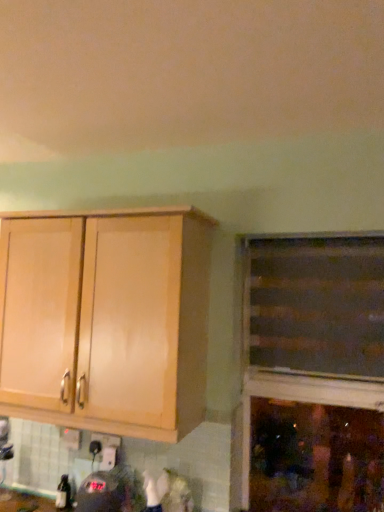
Measure the distance between wooden cabinet at right, acting as the second cabinetry starting from the left, and camera.

5.32 feet.

Find the location of `light wood cabinet at left, placed as the 1th cabinetry when sorted from left to right`. light wood cabinet at left, placed as the 1th cabinetry when sorted from left to right is located at coordinates point(106,321).

Could wooden cabinet at right, which is the 1th cabinetry from right to left, be considered to be inside white plastic electric outlet at lower center?

That's incorrect, wooden cabinet at right, which is the 1th cabinetry from right to left, is not inside white plastic electric outlet at lower center.

How different are the orientations of white plastic electric outlet at lower center and wooden cabinet at right, which is the 1th cabinetry from right to left, in degrees?

The angular difference between white plastic electric outlet at lower center and wooden cabinet at right, which is the 1th cabinetry from right to left, is 0.597 degrees.

Looking at this image, who is smaller, white plastic electric outlet at lower center or wooden cabinet at right, acting as the second cabinetry starting from the left?

white plastic electric outlet at lower center.

Would you say white plastic electric outlet at lower center is a long distance from wooden cabinet at right, acting as the second cabinetry starting from the left?

Actually, white plastic electric outlet at lower center and wooden cabinet at right, acting as the second cabinetry starting from the left, are a little close together.

Is point (96, 370) positioned after point (116, 435)?

That is False.

Does light wood cabinet at left, which ranks as the 2th cabinetry in right-to-left order, have a lesser height compared to white plastic electric outlet at lower center?

Incorrect, the height of light wood cabinet at left, which ranks as the 2th cabinetry in right-to-left order, does not fall short of that of white plastic electric outlet at lower center.

Is white plastic electric outlet at lower center inside light wood cabinet at left, placed as the 1th cabinetry when sorted from left to right?

No, white plastic electric outlet at lower center is not a part of light wood cabinet at left, placed as the 1th cabinetry when sorted from left to right.

Which is more to the right, wooden cabinet at right, which is the 1th cabinetry from right to left, or white plastic electric outlet at lower center?

wooden cabinet at right, which is the 1th cabinetry from right to left.

From a real-world perspective, which object stands above the other?

In real-world perspective, wooden cabinet at right, acting as the second cabinetry starting from the left, is above.

Is wooden cabinet at right, acting as the second cabinetry starting from the left, oriented away from white plastic electric outlet at lower center?

No, wooden cabinet at right, acting as the second cabinetry starting from the left,'s orientation is not away from white plastic electric outlet at lower center.

Considering the sizes of objects wooden cabinet at right, acting as the second cabinetry starting from the left, and light wood cabinet at left, which ranks as the 2th cabinetry in right-to-left order, in the image provided, who is bigger, wooden cabinet at right, acting as the second cabinetry starting from the left, or light wood cabinet at left, which ranks as the 2th cabinetry in right-to-left order,?

light wood cabinet at left, which ranks as the 2th cabinetry in right-to-left order, is bigger.

From the image's perspective, is wooden cabinet at right, which is the 1th cabinetry from right to left, above or below light wood cabinet at left, which ranks as the 2th cabinetry in right-to-left order?

From the image's perspective, wooden cabinet at right, which is the 1th cabinetry from right to left, appears above light wood cabinet at left, which ranks as the 2th cabinetry in right-to-left order.

Is wooden cabinet at right, acting as the second cabinetry starting from the left, positioned beyond the bounds of light wood cabinet at left, placed as the 1th cabinetry when sorted from left to right?

Absolutely, wooden cabinet at right, acting as the second cabinetry starting from the left, is external to light wood cabinet at left, placed as the 1th cabinetry when sorted from left to right.

Is wooden cabinet at right, acting as the second cabinetry starting from the left, far from light wood cabinet at left, which ranks as the 2th cabinetry in right-to-left order?

No, wooden cabinet at right, acting as the second cabinetry starting from the left, is not far away from light wood cabinet at left, which ranks as the 2th cabinetry in right-to-left order.

Is light wood cabinet at left, which ranks as the 2th cabinetry in right-to-left order, looking in the opposite direction of wooden cabinet at right, which is the 1th cabinetry from right to left?

No, light wood cabinet at left, which ranks as the 2th cabinetry in right-to-left order,'s orientation is not away from wooden cabinet at right, which is the 1th cabinetry from right to left.

Can you confirm if light wood cabinet at left, placed as the 1th cabinetry when sorted from left to right, is positioned to the right of wooden cabinet at right, acting as the second cabinetry starting from the left?

No.

Based on their sizes in the image, would you say light wood cabinet at left, placed as the 1th cabinetry when sorted from left to right, is bigger or smaller than wooden cabinet at right, acting as the second cabinetry starting from the left?

In the image, light wood cabinet at left, placed as the 1th cabinetry when sorted from left to right, appears to be larger than wooden cabinet at right, acting as the second cabinetry starting from the left.

Considering the positions of points (94, 439) and (66, 318), is point (94, 439) farther from camera compared to point (66, 318)?

Yes.

You are a GUI agent. You are given a task and a screenshot of the screen. Output one action in this format:
    pyautogui.click(x=<x>, y=<y>)
    Task: Click on the electric outlet behind the light wood cabinet at left, which ranks as the 2th cabinetry in right-to-left order
    This screenshot has width=384, height=512.
    Given the screenshot: What is the action you would take?
    pyautogui.click(x=107, y=440)

Considering the relative positions of white plastic electric outlet at lower center and light wood cabinet at left, placed as the 1th cabinetry when sorted from left to right, in the image provided, is white plastic electric outlet at lower center in front of light wood cabinet at left, placed as the 1th cabinetry when sorted from left to right,?

No, the depth of white plastic electric outlet at lower center is greater than that of light wood cabinet at left, placed as the 1th cabinetry when sorted from left to right.

From a real-world perspective, which is physically above, white plastic electric outlet at lower center or light wood cabinet at left, which ranks as the 2th cabinetry in right-to-left order?

From a 3D spatial view, light wood cabinet at left, which ranks as the 2th cabinetry in right-to-left order, is above.

Identify the location of the 2nd cabinetry above when counting from the white plastic electric outlet at lower center (from the image's perspective). (316, 306).

I want to click on the 2nd cabinetry in front when counting from the white plastic electric outlet at lower center, so click(106, 321).

Looking at the image, which one is located closer to wooden cabinet at right, which is the 1th cabinetry from right to left, light wood cabinet at left, which ranks as the 2th cabinetry in right-to-left order, or white plastic electric outlet at lower center?

The object closer to wooden cabinet at right, which is the 1th cabinetry from right to left, is light wood cabinet at left, which ranks as the 2th cabinetry in right-to-left order.

From the image, which object appears to be farther from white plastic electric outlet at lower center, wooden cabinet at right, which is the 1th cabinetry from right to left, or light wood cabinet at left, placed as the 1th cabinetry when sorted from left to right?

Based on the image, wooden cabinet at right, which is the 1th cabinetry from right to left, appears to be further to white plastic electric outlet at lower center.

Estimate the real-world distances between objects in this image. Which object is further from wooden cabinet at right, which is the 1th cabinetry from right to left, white plastic electric outlet at lower center or light wood cabinet at left, which ranks as the 2th cabinetry in right-to-left order?

Based on the image, white plastic electric outlet at lower center appears to be further to wooden cabinet at right, which is the 1th cabinetry from right to left.

Looking at the image, which one is located closer to light wood cabinet at left, placed as the 1th cabinetry when sorted from left to right, wooden cabinet at right, which is the 1th cabinetry from right to left, or white plastic electric outlet at lower center?

wooden cabinet at right, which is the 1th cabinetry from right to left, is positioned closer to the anchor light wood cabinet at left, placed as the 1th cabinetry when sorted from left to right.

From the image, which object appears to be nearer to light wood cabinet at left, placed as the 1th cabinetry when sorted from left to right, white plastic electric outlet at lower center or wooden cabinet at right, which is the 1th cabinetry from right to left?

The object closer to light wood cabinet at left, placed as the 1th cabinetry when sorted from left to right, is wooden cabinet at right, which is the 1th cabinetry from right to left.

Based on their spatial positions, is light wood cabinet at left, which ranks as the 2th cabinetry in right-to-left order, or wooden cabinet at right, which is the 1th cabinetry from right to left, closer to white plastic electric outlet at lower center?

The object closer to white plastic electric outlet at lower center is light wood cabinet at left, which ranks as the 2th cabinetry in right-to-left order.

Locate an element on the screen. Image resolution: width=384 pixels, height=512 pixels. cabinetry between white plastic electric outlet at lower center and wooden cabinet at right, which is the 1th cabinetry from right to left, from left to right is located at coordinates (106, 321).